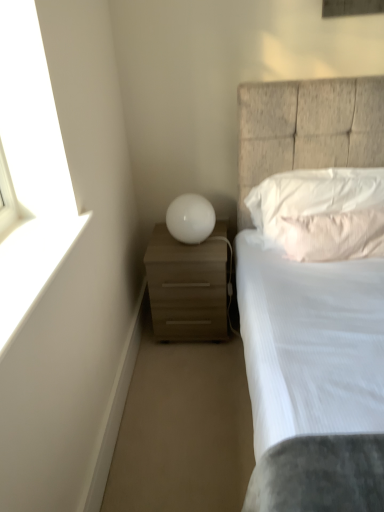
In order to click on vacant space that is to the left of white glossy sphere at center in this screenshot , I will do `click(157, 244)`.